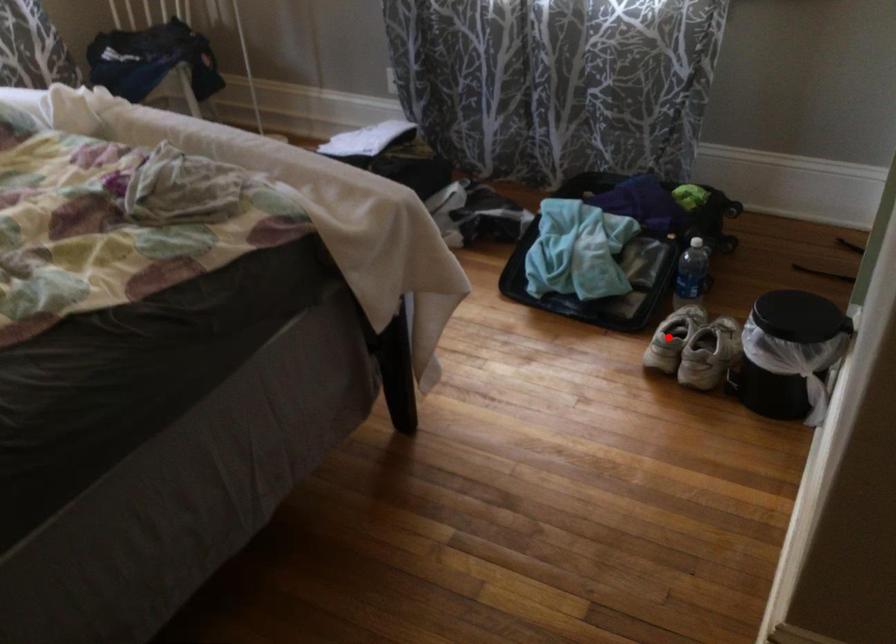
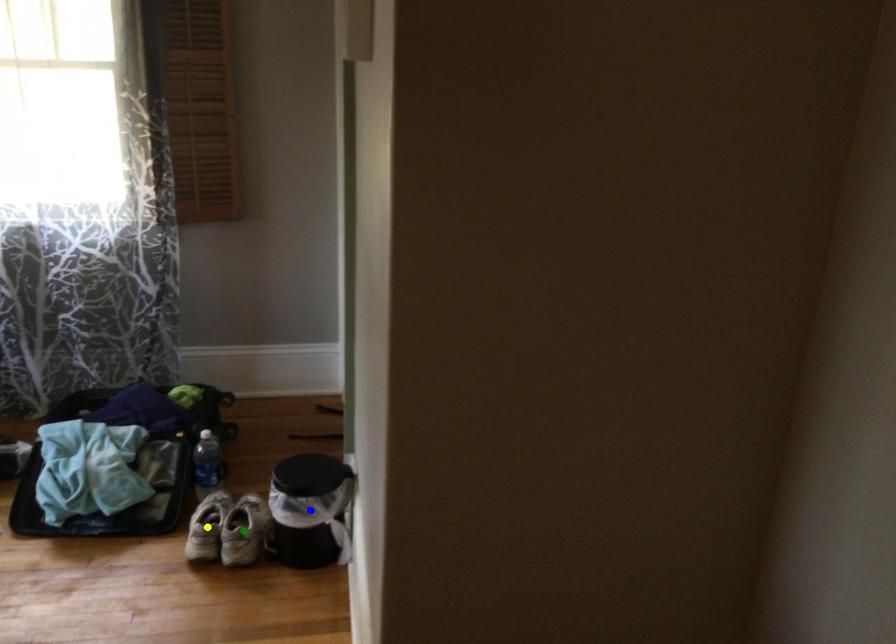
Question: I am providing you with two images of the same scene from different viewpoints. A red point is marked on the first image. You are given multiple points on the second image. Which point in image 2 represents the same 3d spot as the red point in image 1?

Choices:
 (A) yellow point
 (B) blue point
 (C) green point

Answer: (A)